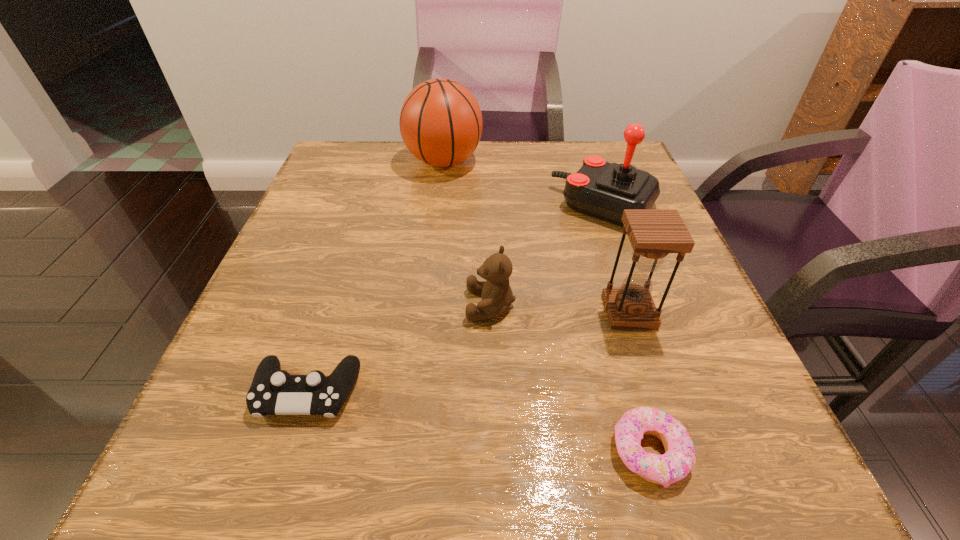
Locate an element on the screen. The image size is (960, 540). free spot between the teddy bear and the control is located at coordinates (398, 348).

Find the location of a particular element. The height and width of the screenshot is (540, 960). empty space that is in between the control and the joystick is located at coordinates (456, 299).

At what (x,y) coordinates should I click in order to perform the action: click on free space that is in between the control and the joystick. Please return your answer as a coordinate pair (x, y). The image size is (960, 540). Looking at the image, I should click on (456, 299).

At what (x,y) coordinates should I click in order to perform the action: click on free space between the hourglass and the control. Please return your answer as a coordinate pair (x, y). Looking at the image, I should click on (468, 352).

I want to click on vacant space that is in between the fifth tallest object and the joystick, so click(x=456, y=299).

Locate an element on the screen. This screenshot has width=960, height=540. free point between the fifth tallest object and the hourglass is located at coordinates (468, 352).

Where is `free space between the joystick and the fifth tallest object`? free space between the joystick and the fifth tallest object is located at coordinates (456, 299).

I want to click on free space between the joystick and the fifth tallest object, so [456, 299].

Locate which object ranks fourth in proximity to the basketball. Please provide its 2D coordinates. Your answer should be formatted as a tuple, i.e. [(x, y)], where the tuple contains the x and y coordinates of a point satisfying the conditions above.

[(273, 391)]

Find the location of a particular element. The image size is (960, 540). object that ranks as the fourth closest to the fifth tallest object is located at coordinates (604, 190).